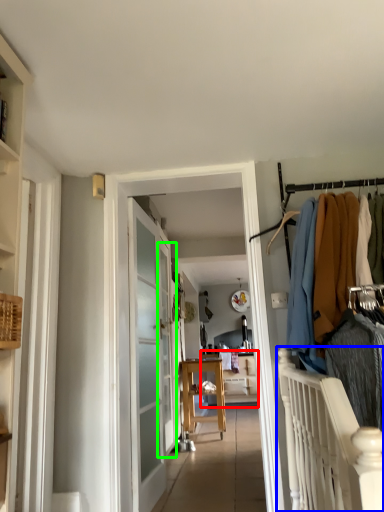
Question: Estimate the real-world distances between objects in this image. Which object is farther from furniture (highlighted by a red box), balustrade (highlighted by a blue box) or screen door (highlighted by a green box)?

Choices:
 (A) balustrade
 (B) screen door

Answer: (A)